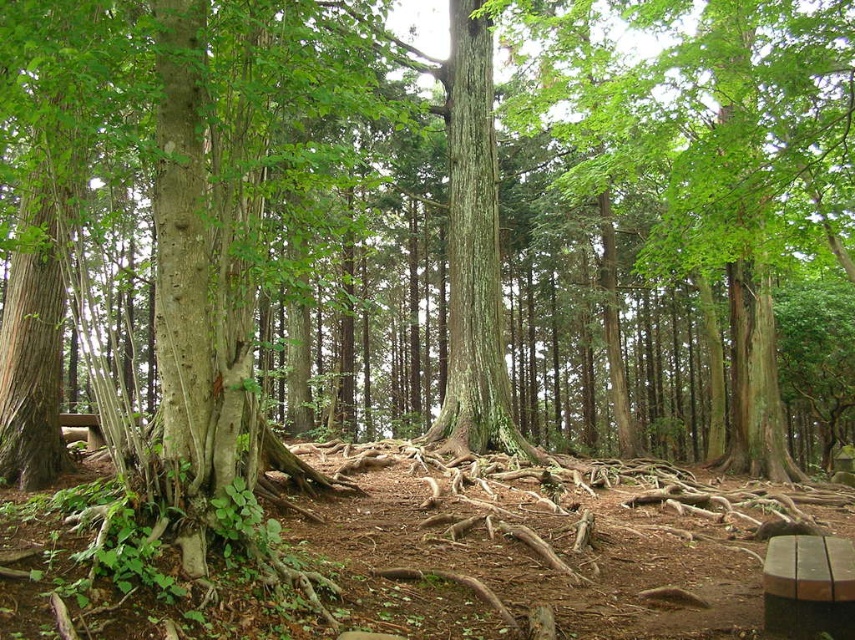
Can you confirm if green rough bark tree at upper center is wider than green rough bark tree trunk at center?

Yes, green rough bark tree at upper center is wider than green rough bark tree trunk at center.

Which is behind, point (718, 252) or point (478, 428)?

Positioned behind is point (478, 428).

Is point (488, 8) farther from viewer compared to point (482, 202)?

No, it is not.

At what (x,y) coordinates should I click in order to perform the action: click on green rough bark tree at upper center. Please return your answer as a coordinate pair (x, y). Looking at the image, I should click on (708, 156).